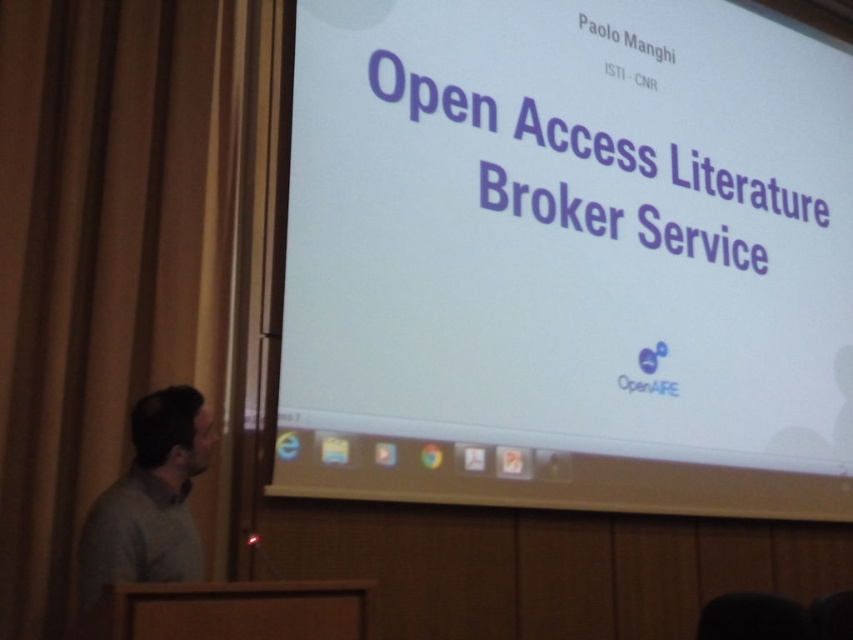
Which is more to the right, white matte projection screen at center or gray sweater at left?

white matte projection screen at center is more to the right.

The image size is (853, 640). What do you see at coordinates (567, 257) in the screenshot? I see `white matte projection screen at center` at bounding box center [567, 257].

Find the location of a particular element. This screenshot has height=640, width=853. white matte projection screen at center is located at coordinates (567, 257).